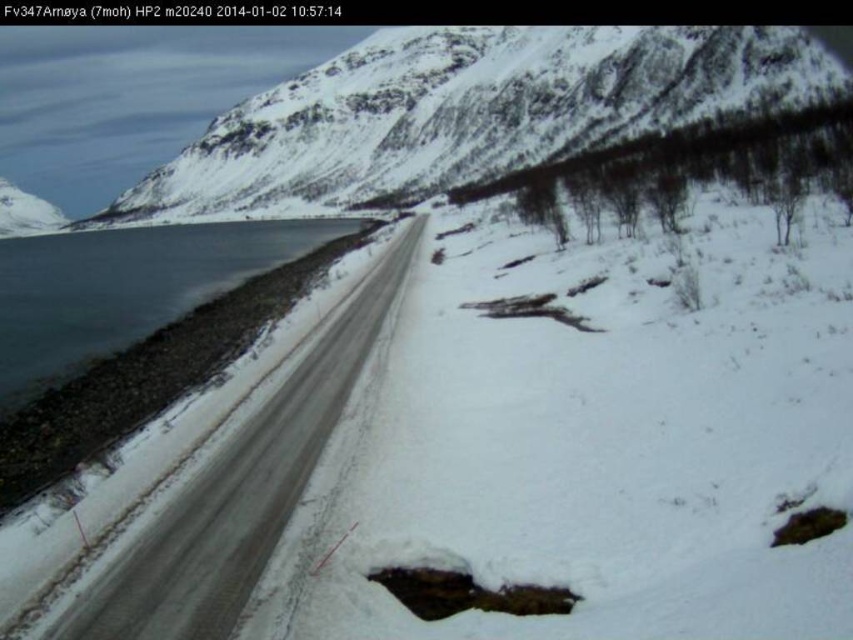
Question: Which object is farther from the camera taking this photo?

Choices:
 (A) snowy asphalt road at left
 (B) snowy rock at upper center

Answer: (B)

Question: From the image, what is the correct spatial relationship of snowy rock at upper center in relation to snowy asphalt road at left?

Choices:
 (A) above
 (B) below

Answer: (A)

Question: Is snowy rock at upper center behind snowy asphalt road at left?

Choices:
 (A) no
 (B) yes

Answer: (B)

Question: Can you confirm if snowy rock at upper center is bigger than snowy asphalt road at left?

Choices:
 (A) no
 (B) yes

Answer: (B)